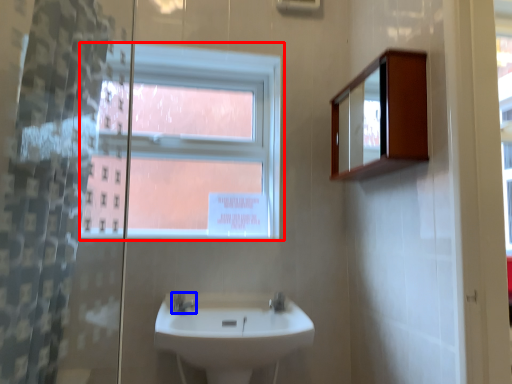
Question: Which of the following is the closest to the observer, window (highlighted by a red box) or tap (highlighted by a blue box)?

Choices:
 (A) window
 (B) tap

Answer: (B)